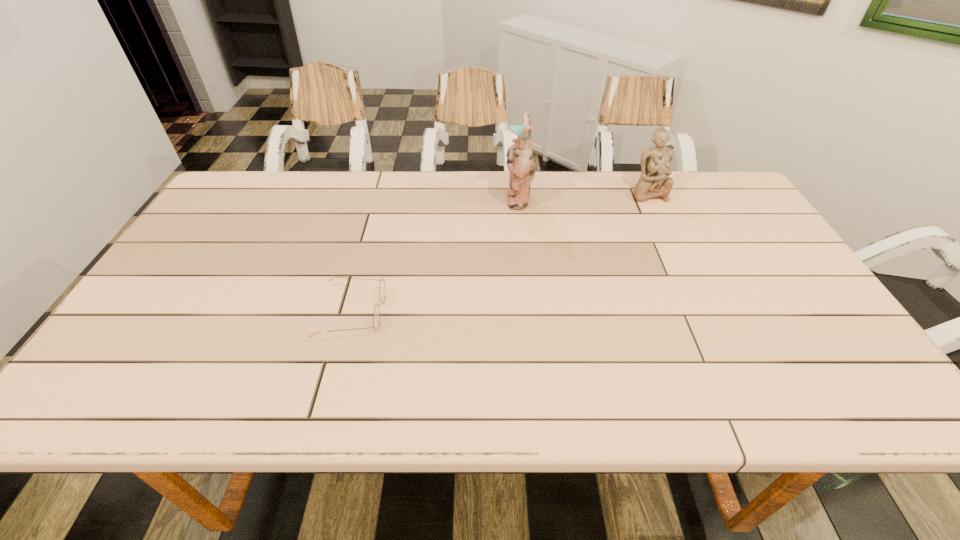
Image resolution: width=960 pixels, height=540 pixels. What are the coordinates of `free space that satisfies the following two spatial constraints: 1. on the front-facing side of the shorter figurine; 2. on the temples of the shortest object` in the screenshot? It's located at (705, 313).

Identify the location of vacant area in the image that satisfies the following two spatial constraints: 1. on the front-facing side of the shorter figurine; 2. on the front-facing side of the left figurine. (651, 199).

Find the location of `vacant point that satisfies the following two spatial constraints: 1. on the front-facing side of the second shortest object; 2. on the temples of the nearest object`. vacant point that satisfies the following two spatial constraints: 1. on the front-facing side of the second shortest object; 2. on the temples of the nearest object is located at coordinates (705, 313).

At what (x,y) coordinates should I click in order to perform the action: click on vacant region that satisfies the following two spatial constraints: 1. on the front-facing side of the second tallest object; 2. on the front-facing side of the tallest object. Please return your answer as a coordinate pair (x, y). The width and height of the screenshot is (960, 540). Looking at the image, I should click on (651, 199).

Find the location of a particular element. Image resolution: width=960 pixels, height=540 pixels. vacant space that satisfies the following two spatial constraints: 1. on the front-facing side of the second tallest object; 2. on the front-facing side of the tallest object is located at coordinates (651, 199).